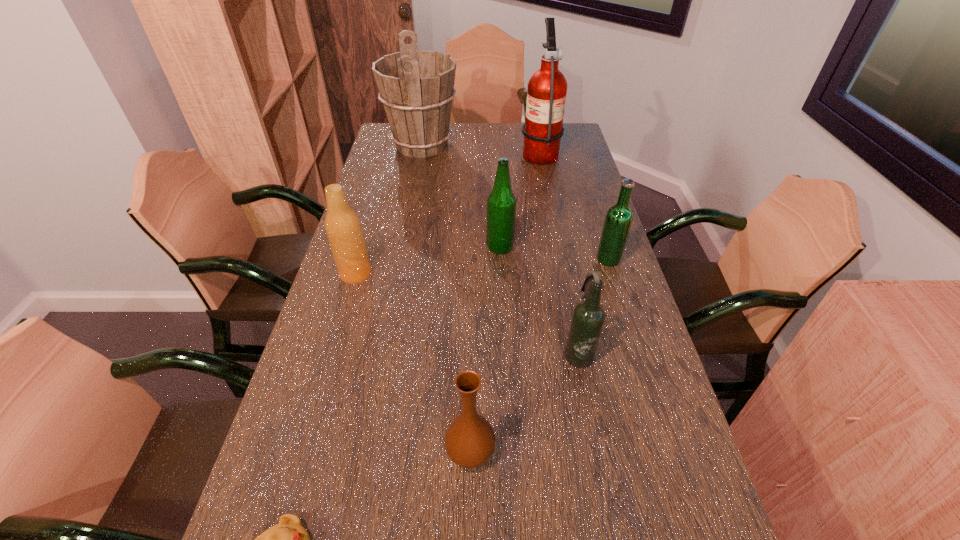
The height and width of the screenshot is (540, 960). What are the coordinates of `vacant area that satisfies the following two spatial constraints: 1. on the label of the second beer bottle from left to right; 2. on the left side of the rightmost object` in the screenshot? It's located at (500, 259).

Where is `free space that satisfies the following two spatial constraints: 1. on the nozzle and handle of the fire extinguisher; 2. on the left side of the rightmost object`? free space that satisfies the following two spatial constraints: 1. on the nozzle and handle of the fire extinguisher; 2. on the left side of the rightmost object is located at coordinates (561, 259).

Locate an element on the screen. The height and width of the screenshot is (540, 960). free region that satisfies the following two spatial constraints: 1. on the back side of the rightmost object; 2. on the nozzle and handle of the tallest object is located at coordinates (575, 152).

The height and width of the screenshot is (540, 960). I want to click on free space that satisfies the following two spatial constraints: 1. on the nozzle and handle of the rightmost beer bottle; 2. on the right side of the fire extinguisher, so click(x=561, y=259).

I want to click on vacant area that satisfies the following two spatial constraints: 1. on the back side of the rightmost object; 2. on the nozzle and handle of the tallest object, so click(575, 152).

This screenshot has height=540, width=960. Identify the location of free space that satisfies the following two spatial constraints: 1. on the back side of the rightmost object; 2. on the nozzle and handle of the tallest object. click(x=575, y=152).